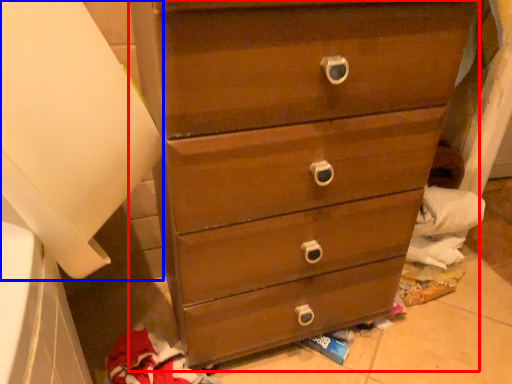
Question: Among these objects, which one is farthest to the camera, chest of drawers (highlighted by a red box) or paper towel (highlighted by a blue box)?

Choices:
 (A) chest of drawers
 (B) paper towel

Answer: (A)